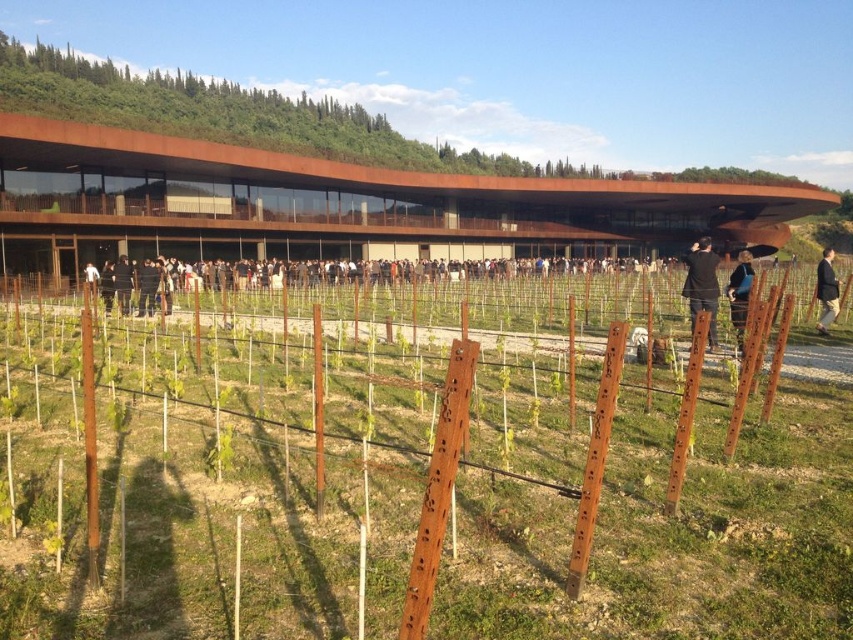
Question: Among these objects, which one is nearest to the camera?

Choices:
 (A) black fabric at center
 (B) black fabric jacket at center
 (C) blue fabric at center

Answer: (B)

Question: Which of these objects is positioned closest to the black fabric jacket at center?

Choices:
 (A) rustic wood building at upper center
 (B) blue fabric at center
 (C) black fabric jacket at lower right

Answer: (B)

Question: Is blue fabric at center above black fabric jacket at lower right?

Choices:
 (A) yes
 (B) no

Answer: (B)

Question: Which of the following is the closest to the observer?

Choices:
 (A) (374, 134)
 (B) (741, 336)

Answer: (B)

Question: Can you confirm if blue fabric at center is positioned to the left of black fabric jacket at lower right?

Choices:
 (A) yes
 (B) no

Answer: (A)

Question: Can you confirm if black fabric at center is positioned below black fabric jacket at center?

Choices:
 (A) yes
 (B) no

Answer: (A)